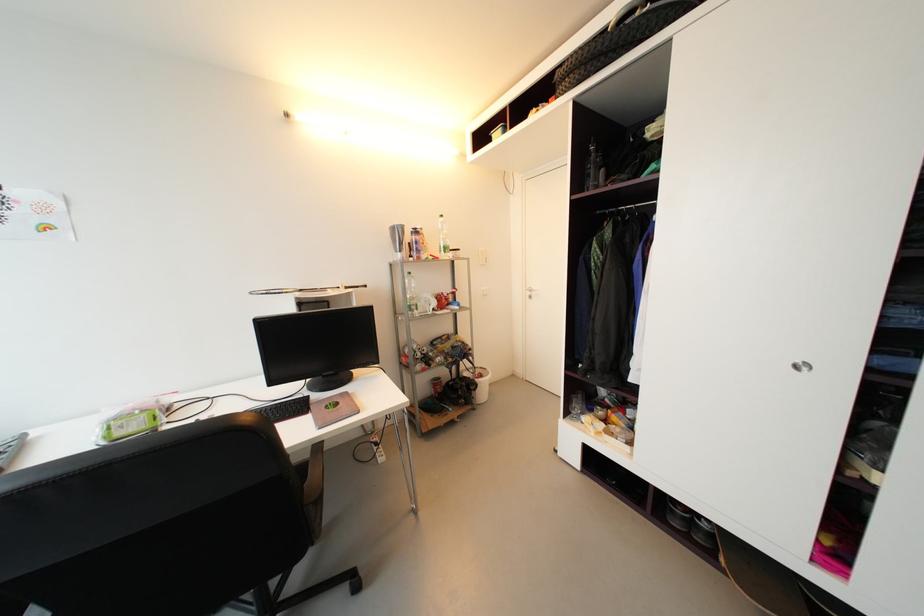
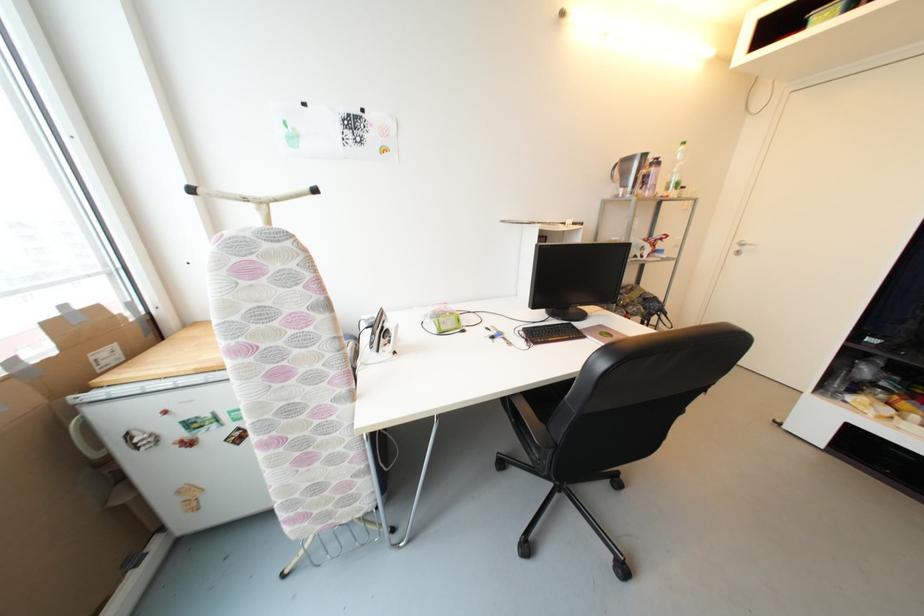
Locate, in the second image, the point that corresponds to [533,294] in the first image.

(742, 249)